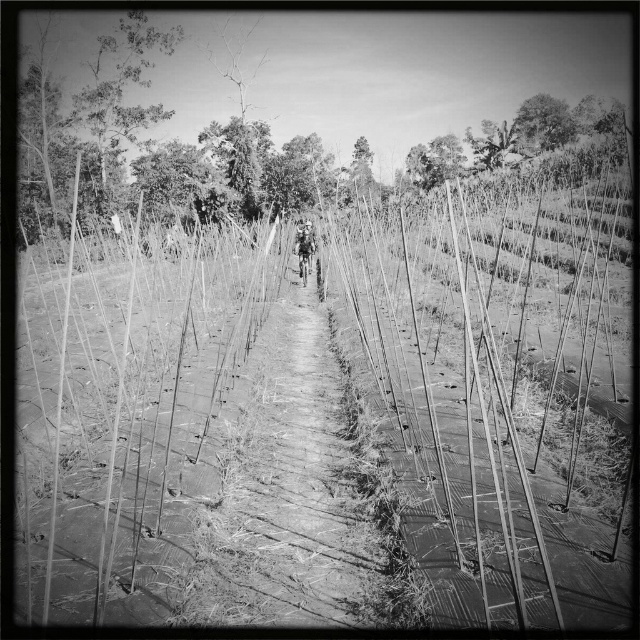
Measure the distance from thick foliage at center to smooth bark tree at upper center.

A distance of 29.94 meters exists between thick foliage at center and smooth bark tree at upper center.

Who is shorter, thick foliage at center or smooth bark tree at upper center?

thick foliage at center is shorter.

At what (x,y) coordinates should I click in order to perform the action: click on thick foliage at center. Please return your answer as a coordinate pair (x, y). This screenshot has width=640, height=640. Looking at the image, I should click on (180, 180).

Locate an element on the screen. thick foliage at center is located at coordinates (180, 180).

Based on the photo, is smooth bamboo at center to the right of thick foliage at center from the viewer's perspective?

Yes, smooth bamboo at center is to the right of thick foliage at center.

Is point (92, 282) positioned after point (204, 204)?

No, (92, 282) is in front of (204, 204).

The height and width of the screenshot is (640, 640). What do you see at coordinates (324, 413) in the screenshot?
I see `smooth bamboo at center` at bounding box center [324, 413].

You are a GUI agent. You are given a task and a screenshot of the screen. Output one action in this format:
    pyautogui.click(x=<x>, y=<y>)
    Task: Click on the smooth bamboo at center
    
    Given the screenshot: What is the action you would take?
    pyautogui.click(x=324, y=413)

Is smooth bamboo at center above smooth bark tree at upper center?

Actually, smooth bamboo at center is below smooth bark tree at upper center.

Find the location of a particular element. This screenshot has height=640, width=640. smooth bamboo at center is located at coordinates (324, 413).